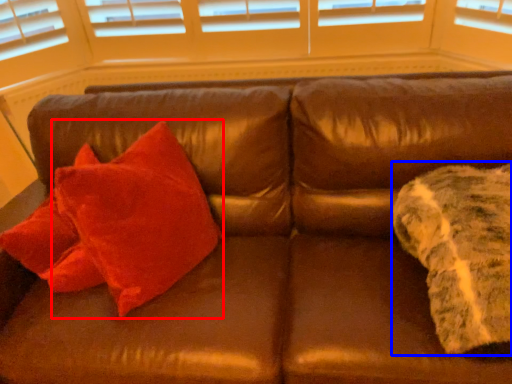
Question: Which object appears farthest to the camera in this image, throw pillow (highlighted by a red box) or blanket (highlighted by a blue box)?

Choices:
 (A) throw pillow
 (B) blanket

Answer: (A)